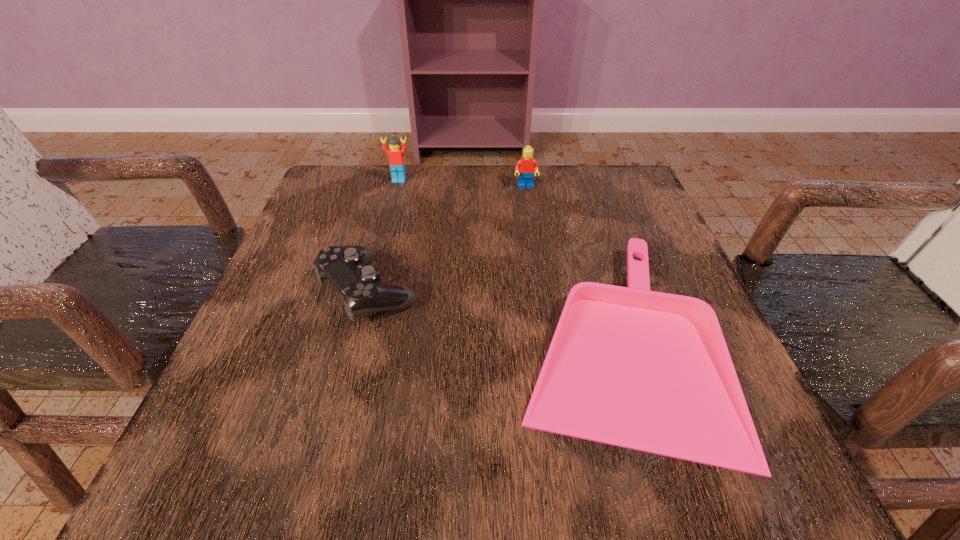
This screenshot has width=960, height=540. What are the coordinates of `the farthest object` in the screenshot? It's located at 396,161.

This screenshot has height=540, width=960. I want to click on the farther Lego, so click(396, 161).

Find the location of a particular element. Image resolution: width=960 pixels, height=540 pixels. the second farthest object is located at coordinates (527, 166).

Where is `the nearer Lego`? The width and height of the screenshot is (960, 540). the nearer Lego is located at coordinates (527, 166).

Locate an element on the screen. Image resolution: width=960 pixels, height=540 pixels. the third tallest object is located at coordinates (345, 267).

Where is `dustpan`? The height and width of the screenshot is (540, 960). dustpan is located at coordinates (650, 371).

The image size is (960, 540). Identify the location of vacant region located on the face of the farther Lego. (383, 241).

The height and width of the screenshot is (540, 960). I want to click on vacant space located 0.380m on the face of the right Lego, so click(543, 312).

Locate an element on the screen. This screenshot has height=540, width=960. vacant space positioned on the front of the third tallest object is located at coordinates (347, 373).

Where is `free point located on the handle side of the shortest object`? Image resolution: width=960 pixels, height=540 pixels. free point located on the handle side of the shortest object is located at coordinates (483, 341).